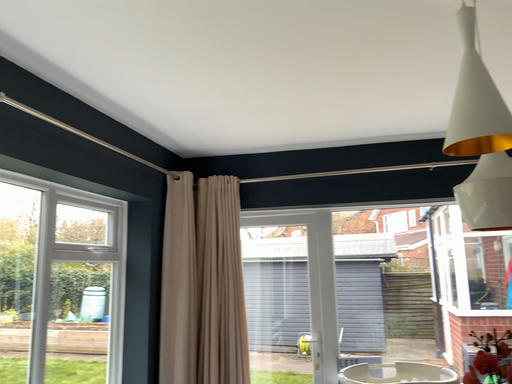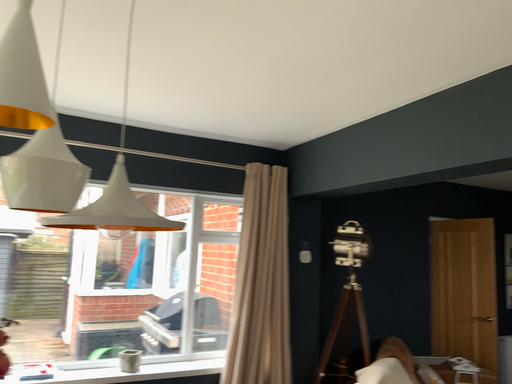
Question: Which way did the camera rotate in the video?

Choices:
 (A) rotated upward
 (B) rotated downward

Answer: (B)